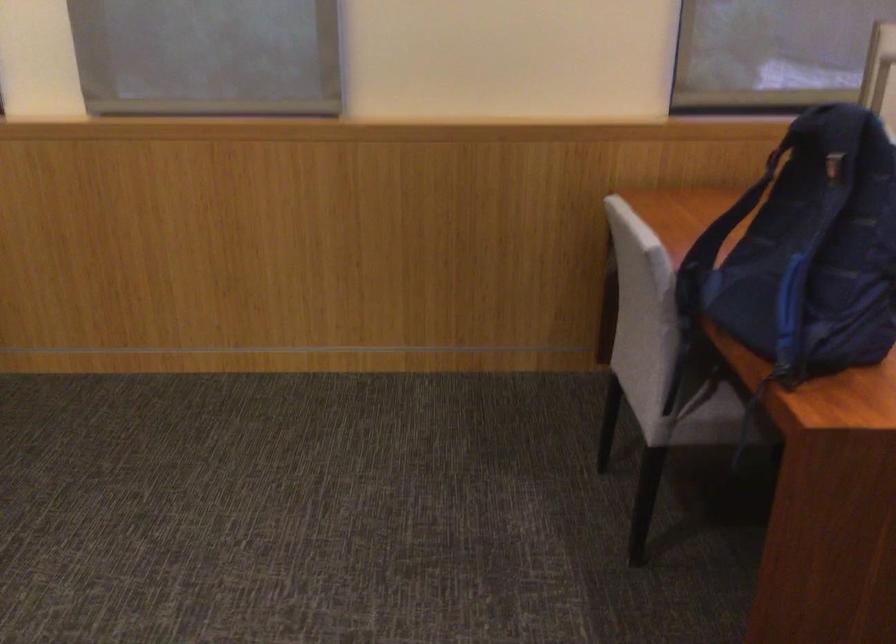
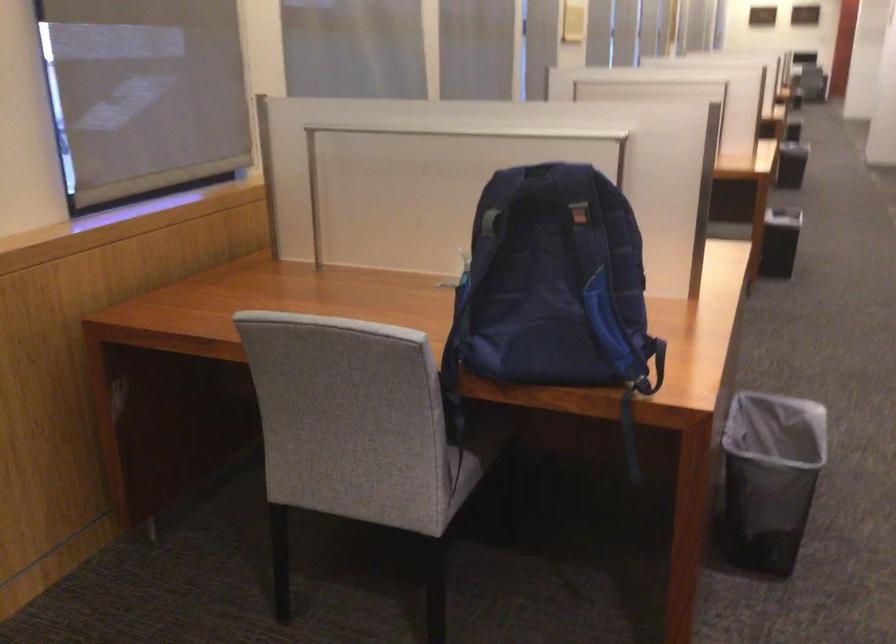
The point at [810,248] is marked in the first image. Where is the corresponding point in the second image?

(552, 281)